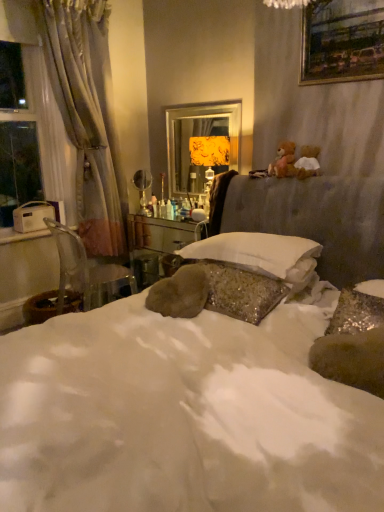
This screenshot has height=512, width=384. Describe the element at coordinates (87, 117) in the screenshot. I see `white sheer curtain at left` at that location.

Describe the element at coordinates (86, 270) in the screenshot. I see `clear plastic chair at left` at that location.

Describe the element at coordinates (201, 146) in the screenshot. I see `metallic gold mirror at center` at that location.

This screenshot has height=512, width=384. I want to click on white sheer curtain at left, so click(87, 117).

Is transparent glass window at left outside of metallic gold mirror at center?

Yes, transparent glass window at left is located beyond the bounds of metallic gold mirror at center.

Which object is further away from the camera taking this photo, transparent glass window at left or metallic gold mirror at center?

metallic gold mirror at center is more distant.

Can you tell me how much transparent glass window at left and metallic gold mirror at center differ in facing direction?

There is a 88.8-degree angle between the facing directions of transparent glass window at left and metallic gold mirror at center.

Does transparent glass window at left touch metallic gold mirror at center?

They are not placed beside each other.

Which object is further away from the camera, transparent glass window at left or wooden vanity at center?

wooden vanity at center is behind.

Considering the sizes of objects transparent glass window at left and wooden vanity at center in the image provided, who is taller, transparent glass window at left or wooden vanity at center?

Standing taller between the two is transparent glass window at left.

From a real-world perspective, which is physically above, transparent glass window at left or wooden vanity at center?

In real-world perspective, transparent glass window at left is above.

Can you tell me how much white soft pillow at center and clear plastic chair at left differ in facing direction?

173 degrees.

Does white soft pillow at center have a lesser width compared to clear plastic chair at left?

Correct, the width of white soft pillow at center is less than that of clear plastic chair at left.

You are a GUI agent. You are given a task and a screenshot of the screen. Output one action in this format:
    pyautogui.click(x=<x>, y=<y>)
    Task: Click on the pillow above the clear plastic chair at left (from a real-world perspective)
    
    Given the screenshot: What is the action you would take?
    pyautogui.click(x=254, y=250)

What's the angular difference between white sheer curtain at left and clear plastic chair at left's facing directions?

The angle between the facing direction of white sheer curtain at left and the facing direction of clear plastic chair at left is 81 degrees.

Are white sheer curtain at left and clear plastic chair at left making contact?

No, white sheer curtain at left is not making contact with clear plastic chair at left.

Find the location of a particular element. This screenshot has width=384, height=512. curtain located behind the clear plastic chair at left is located at coordinates (87, 117).

Is clear plastic chair at left directly adjacent to white sheer curtain at left?

There is a gap between clear plastic chair at left and white sheer curtain at left.

Which is closer to the camera, (x=63, y=296) or (x=73, y=54)?

Point (x=63, y=296) is farther from the camera than point (x=73, y=54).

This screenshot has height=512, width=384. I want to click on curtain above the clear plastic chair at left (from the image's perspective), so click(x=87, y=117).

Which object is thinner, clear plastic chair at left or white sheer curtain at left?

white sheer curtain at left is thinner.

Considering the positions of point (343, 24) and point (118, 273), is point (343, 24) closer or farther from the camera than point (118, 273)?

Point (343, 24) is positioned closer to the camera compared to point (118, 273).

Visually, is gold-framed painting at upper right positioned to the left or to the right of clear plastic chair at left?

From the image, it's evident that gold-framed painting at upper right is to the right of clear plastic chair at left.

From a real-world perspective, is gold-framed painting at upper right positioned over clear plastic chair at left based on gravity?

Yes, from a real-world perspective, gold-framed painting at upper right is over clear plastic chair at left

Which of these two, gold-framed painting at upper right or clear plastic chair at left, stands taller?

Standing taller between the two is clear plastic chair at left.

Is wooden vanity at center smaller than metallic gold mirror at center?

Incorrect, wooden vanity at center is not smaller in size than metallic gold mirror at center.

Is wooden vanity at center outside of metallic gold mirror at center?

Yes, wooden vanity at center is located beyond the bounds of metallic gold mirror at center.

Considering the sizes of objects wooden vanity at center and metallic gold mirror at center in the image provided, who is shorter, wooden vanity at center or metallic gold mirror at center?

Standing shorter between the two is wooden vanity at center.

Are wooden vanity at center and metallic gold mirror at center located far from each other?

That's not correct — wooden vanity at center is a little close to metallic gold mirror at center.

Locate an element on the screen. The height and width of the screenshot is (512, 384). mirror below the transparent glass window at left (from the image's perspective) is located at coordinates (201, 146).

Image resolution: width=384 pixels, height=512 pixels. In order to click on vanity on the right of transparent glass window at left in this screenshot , I will do click(157, 244).

Looking at the image, which one is located further to wooden vanity at center, transparent glass window at left or gold-framed painting at upper right?

Based on the image, gold-framed painting at upper right appears to be further to wooden vanity at center.

Based on their spatial positions, is white sheer curtain at left or metallic gold mirror at center closer to clear plastic chair at left?

The object closer to clear plastic chair at left is white sheer curtain at left.

From the image, which object appears to be farther from white sheer curtain at left, transparent glass window at left or gold-framed painting at upper right?

gold-framed painting at upper right lies further to white sheer curtain at left than the other object.

When comparing their distances from transparent glass window at left, does white sheer curtain at left or wooden vanity at center seem further?

wooden vanity at center.

From the image, which object appears to be nearer to clear plastic chair at left, wooden vanity at center or white soft pillow at center?

The object closer to clear plastic chair at left is wooden vanity at center.

Based on their spatial positions, is metallic gold mirror at center or white sheer curtain at left further from clear plastic chair at left?

The object further to clear plastic chair at left is metallic gold mirror at center.

Considering their positions, is transparent glass window at left positioned closer to white soft pillow at center than white sheer curtain at left?

Among the two, white sheer curtain at left is located nearer to white soft pillow at center.

Estimate the real-world distances between objects in this image. Which object is further from wooden vanity at center, clear plastic chair at left or gold-framed painting at upper right?

Among the two, gold-framed painting at upper right is located further to wooden vanity at center.

Find the location of a particular element. This screenshot has height=512, width=384. curtain between transparent glass window at left and metallic gold mirror at center from left to right is located at coordinates (87, 117).

Find the location of `curtain between transparent glass window at left and clear plastic chair at left in the up-down direction`. curtain between transparent glass window at left and clear plastic chair at left in the up-down direction is located at coordinates (87, 117).

In order to click on vanity between transparent glass window at left and white soft pillow at center from left to right in this screenshot , I will do `click(157, 244)`.

The height and width of the screenshot is (512, 384). I want to click on mirror between gold-framed painting at upper right and wooden vanity at center from top to bottom, so click(x=201, y=146).